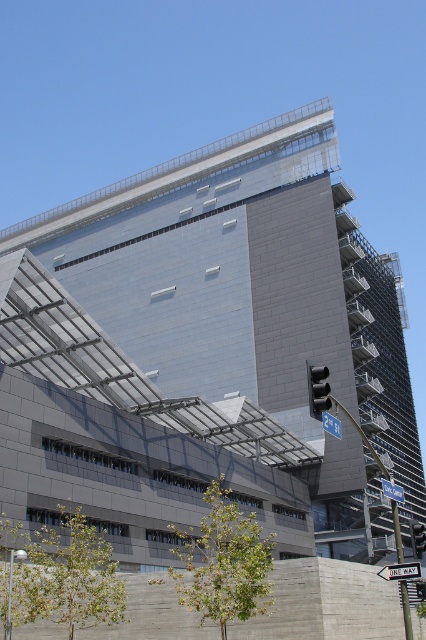
Question: Does black glass traffic light at center have a larger size compared to blue plastic street sign at upper center?

Choices:
 (A) no
 (B) yes

Answer: (B)

Question: Is black glass traffic light at center above blue plastic street sign at upper center?

Choices:
 (A) no
 (B) yes

Answer: (A)

Question: Which point is farther to the camera?

Choices:
 (A) (389, 497)
 (B) (412, 541)
 (C) (399, 577)

Answer: (B)

Question: Is black glass traffic light at center further to camera compared to blue plastic street sign at upper center?

Choices:
 (A) no
 (B) yes

Answer: (B)

Question: Among these objects, which one is nearest to the camera?

Choices:
 (A) black plastic traffic light at center
 (B) blue metallic street sign at upper center
 (C) black glass traffic light at center
 (D) white plastic street sign at lower right

Answer: (A)

Question: Which of these objects is positioned closest to the black glass traffic light at center?

Choices:
 (A) black plastic traffic light at center
 (B) blue plastic street sign at upper center

Answer: (B)